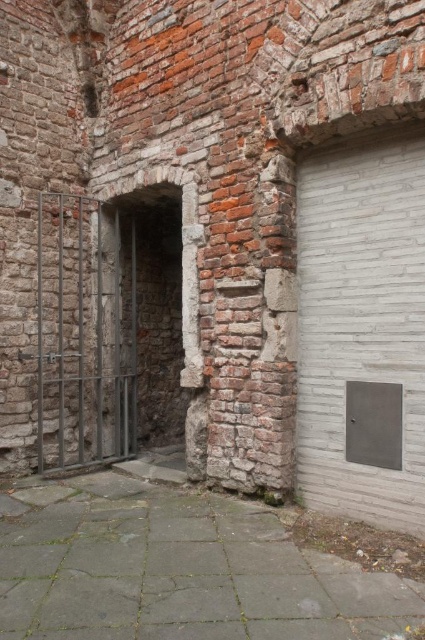
Looking at this image, who is more distant from viewer, (408, 381) or (122, 410)?

Point (122, 410)

Is white matte garage door at right smaller than metallic gate at left?

Correct, white matte garage door at right occupies less space than metallic gate at left.

Does point (345, 211) lie in front of point (101, 460)?

Yes, point (345, 211) is in front of point (101, 460).

Locate an element on the screen. Image resolution: width=425 pixels, height=640 pixels. white matte garage door at right is located at coordinates click(x=362, y=330).

Who is shorter, gray concrete alley at center or metallic gate at left?

Standing shorter between the two is gray concrete alley at center.

Is gray concrete alley at center below metallic gate at left?

Correct, gray concrete alley at center is located below metallic gate at left.

Consider the image. Who is more distant from viewer, (408, 625) or (102, 449)?

The point (102, 449) is behind.

Locate an element on the screen. The image size is (425, 640). gray concrete alley at center is located at coordinates (176, 570).

This screenshot has width=425, height=640. Describe the element at coordinates (176, 570) in the screenshot. I see `gray concrete alley at center` at that location.

Who is shorter, gray concrete alley at center or white matte garage door at right?

With less height is gray concrete alley at center.

Identify the location of gray concrete alley at center. (176, 570).